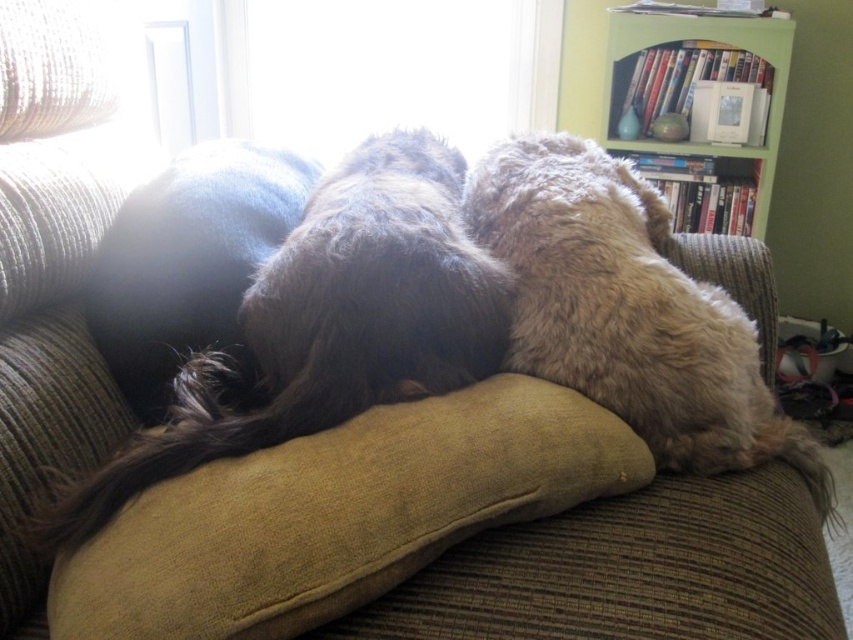
Between fuzzy beige dog at center and transparent glass window at upper center, which one appears on the left side from the viewer's perspective?

Positioned to the left is transparent glass window at upper center.

From the picture: Is fuzzy beige dog at center taller than transparent glass window at upper center?

Indeed, fuzzy beige dog at center has a greater height compared to transparent glass window at upper center.

At what (x,y) coordinates should I click in order to perform the action: click on fuzzy beige dog at center. Please return your answer as a coordinate pair (x, y). The image size is (853, 640). Looking at the image, I should click on (628, 310).

Which is above, transparent glass window at upper center or green wood bookshelf at upper right?

transparent glass window at upper center

Is transparent glass window at upper center wider than green wood bookshelf at upper right?

Correct, the width of transparent glass window at upper center exceeds that of green wood bookshelf at upper right.

Is point (550, 113) positioned behind point (776, 49)?

Yes, it is.

Where is `transparent glass window at upper center`? The height and width of the screenshot is (640, 853). transparent glass window at upper center is located at coordinates (383, 68).

Does fluffy brown dog at center have a greater height compared to transparent glass window at upper center?

Correct, fluffy brown dog at center is much taller as transparent glass window at upper center.

Identify the location of fluffy brown dog at center. The image size is (853, 640). (325, 326).

Who is more forward, [398,362] or [364,51]?

Point [398,362]

Where is `fluffy brown dog at center`? fluffy brown dog at center is located at coordinates (325, 326).